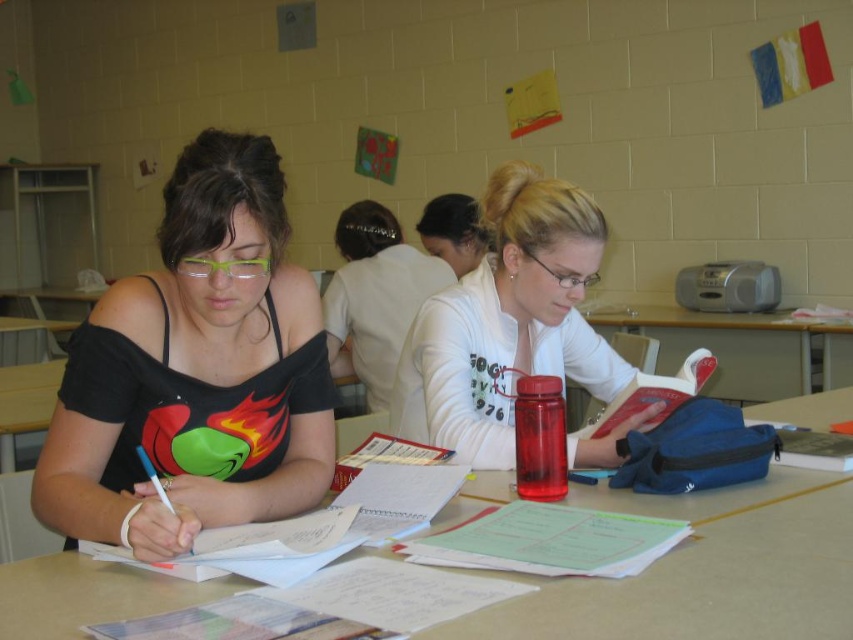
Is black matte tank top at left to the right of matte black tank top at center from the viewer's perspective?

No, black matte tank top at left is not to the right of matte black tank top at center.

Which is more to the left, black matte tank top at left or matte black tank top at center?

black matte tank top at left

At what (x,y) coordinates should I click in order to perform the action: click on black matte tank top at left. Please return your answer as a coordinate pair (x, y). Image resolution: width=853 pixels, height=640 pixels. Looking at the image, I should click on (195, 371).

Does black matte tank top at left come behind white matte sweater at center?

No.

Who is taller, black matte tank top at left or white matte sweater at center?

With more height is black matte tank top at left.

Between point (213, 269) and point (457, 240), which one is positioned in front?

Positioned in front is point (213, 269).

Identify the location of black matte tank top at left. The height and width of the screenshot is (640, 853). (195, 371).

Does matte white sweater at center appear under matte black tank top at center?

Yes, matte white sweater at center is below matte black tank top at center.

Can you confirm if matte white sweater at center is positioned to the left of matte black tank top at center?

In fact, matte white sweater at center is to the right of matte black tank top at center.

Is point (538, 179) less distant than point (344, 362)?

Yes.

The image size is (853, 640). Find the location of `matte white sweater at center`. matte white sweater at center is located at coordinates (508, 323).